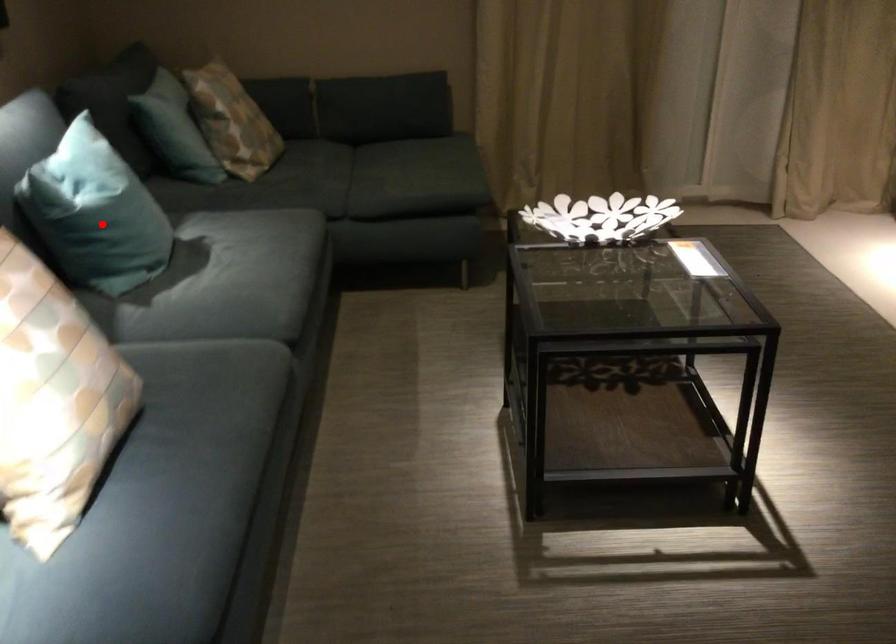
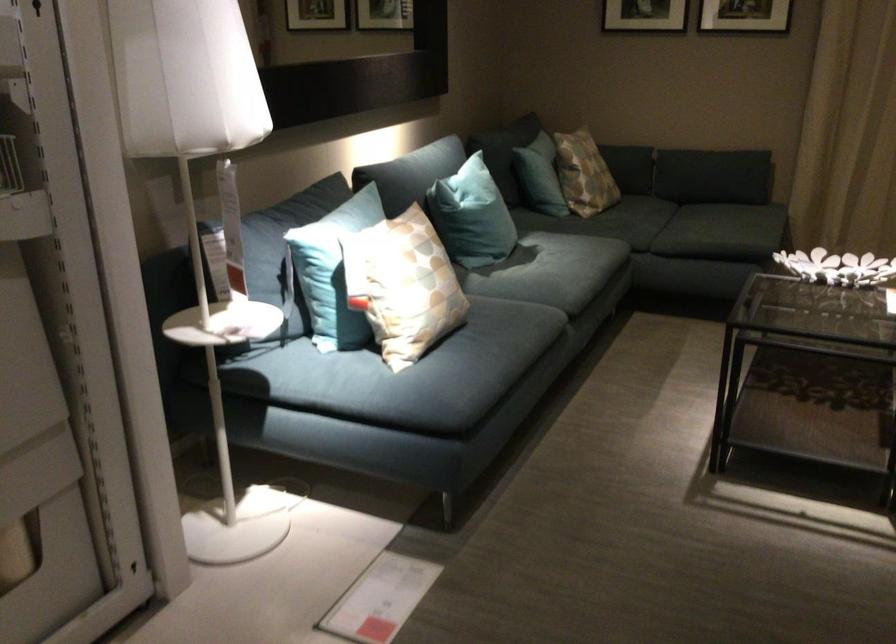
Find the pixel in the second image that matches the highlighted location in the first image.

(471, 216)